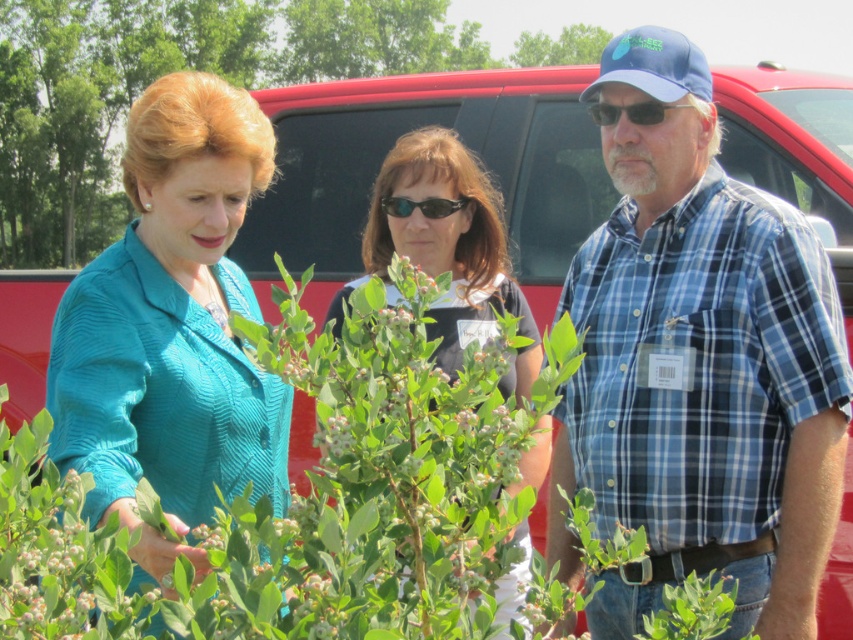
Question: Among these objects, which one is nearest to the camera?

Choices:
 (A) blue plaid shirt at center
 (B) green leafy bush at center

Answer: (B)

Question: Can you confirm if teal fabric jacket at left is thinner than matte black shirt at center?

Choices:
 (A) no
 (B) yes

Answer: (A)

Question: Which object appears closest to the camera in this image?

Choices:
 (A) matte black shirt at center
 (B) green leafy bush at center
 (C) teal fabric jacket at left
 (D) black plastic goggles at center

Answer: (B)

Question: Is the position of green leafy bush at center less distant than that of black plastic goggles at center?

Choices:
 (A) no
 (B) yes

Answer: (B)

Question: In this image, where is matte black shirt at center located relative to sunglasses at center?

Choices:
 (A) right
 (B) left

Answer: (B)

Question: Based on their relative distances, which object is farther from the blue plaid shirt at center?

Choices:
 (A) black plastic goggles at center
 (B) green leafy bush at center
 (C) green leafy plant at center

Answer: (C)